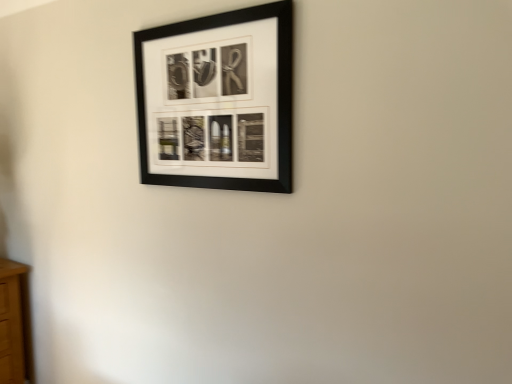
This screenshot has width=512, height=384. Describe the element at coordinates (218, 100) in the screenshot. I see `black matte picture frame at upper center` at that location.

Measure the distance between black matte picture frame at upper center and camera.

3.91 feet.

The width and height of the screenshot is (512, 384). I want to click on black matte picture frame at upper center, so click(218, 100).

I want to click on black matte picture frame at upper center, so click(218, 100).